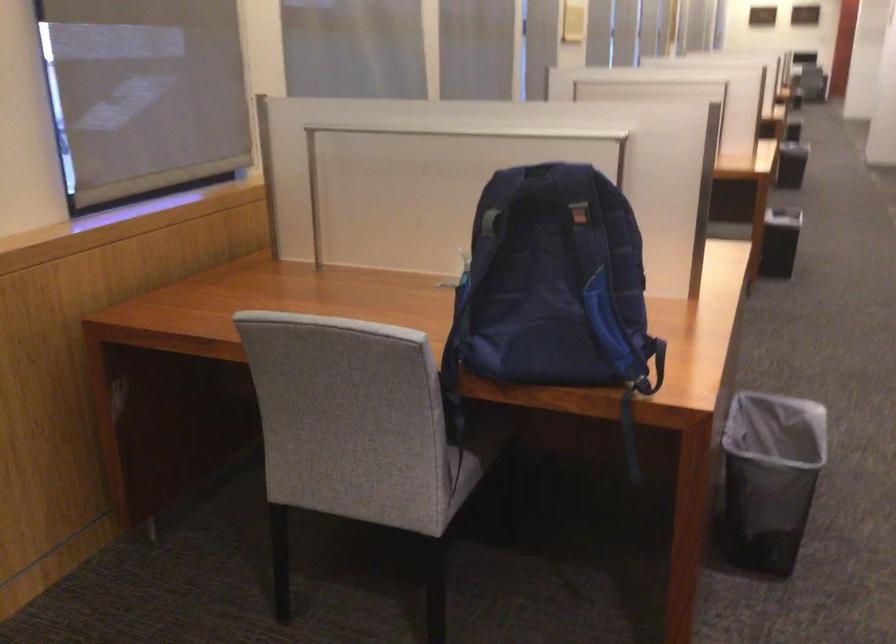
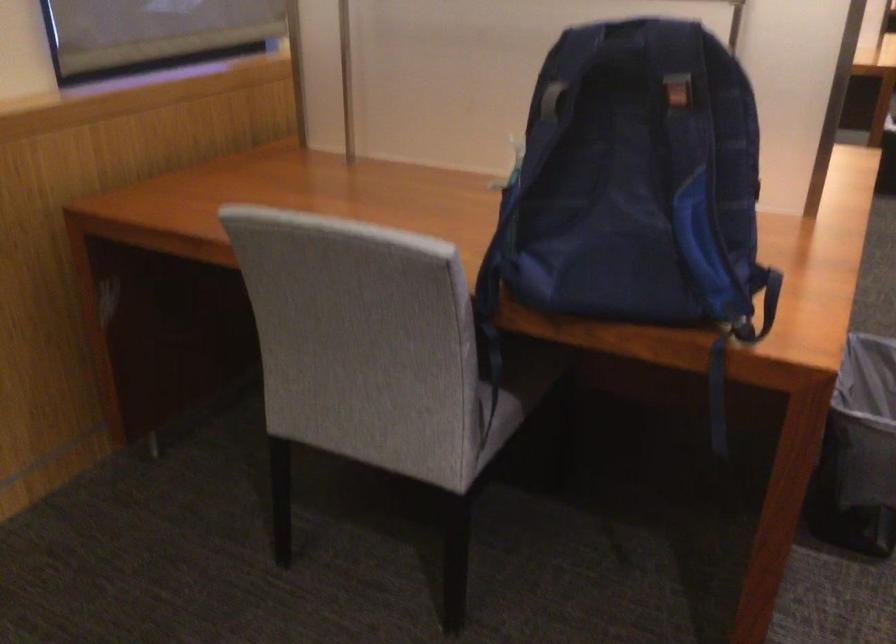
Question: The first image is from the beginning of the video and the second image is from the end. How did the camera likely rotate when shooting the video?

Choices:
 (A) Left
 (B) Right
 (C) Up
 (D) Down

Answer: (D)